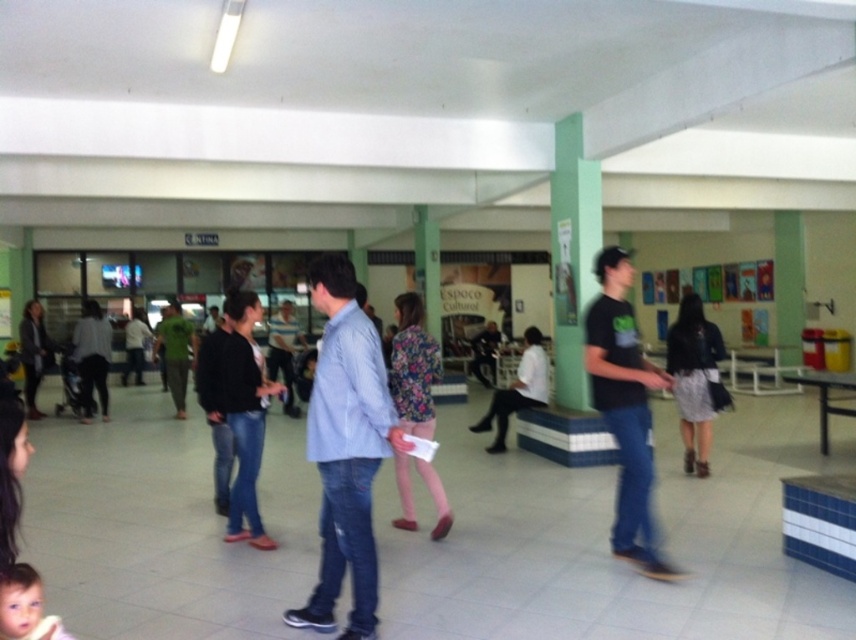
You are standing at the entrance of the public space and see two points marked in the scene. The first point is at coordinate point [33,573] and the second is at coordinate point [88,381]. Which point is closer to you?

Point [33,573] is in front of point [88,381], so it is closer to you.